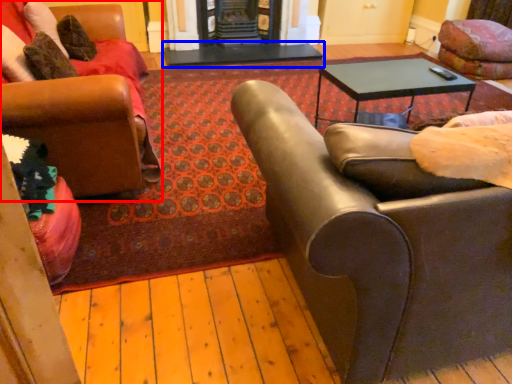
Question: Which object appears closest to the camera in this image, chair (highlighted by a red box) or table (highlighted by a blue box)?

Choices:
 (A) chair
 (B) table

Answer: (A)